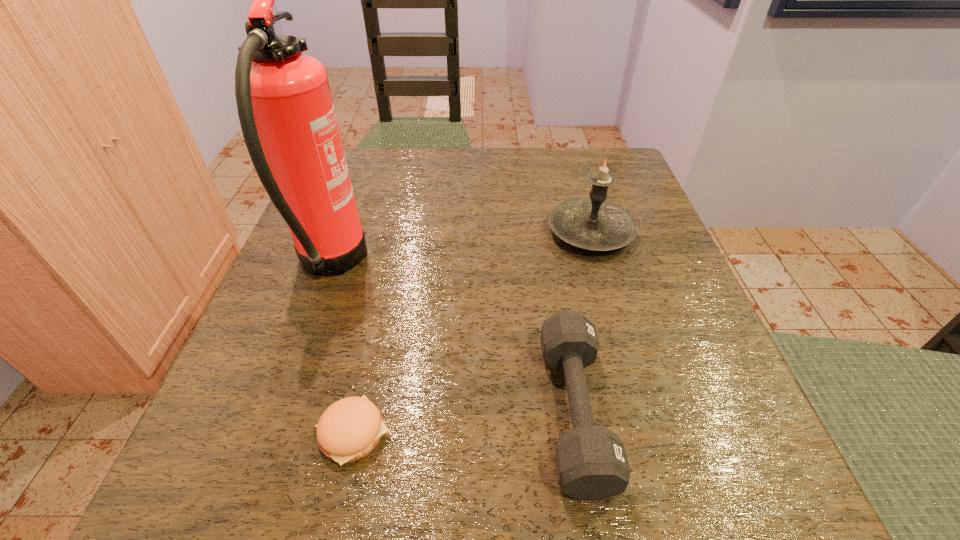
At what (x,y) coordinates should I click in order to perform the action: click on the tallest object. Please return your answer as a coordinate pair (x, y). Image resolution: width=960 pixels, height=540 pixels. Looking at the image, I should click on (285, 107).

Find the location of a particular element. This screenshot has width=960, height=540. candle is located at coordinates (593, 223).

You are a GUI agent. You are given a task and a screenshot of the screen. Output one action in this format:
    pyautogui.click(x=<x>, y=<y>)
    Task: Click on the dumbbell
    This screenshot has height=540, width=960.
    Given the screenshot: What is the action you would take?
    pyautogui.click(x=591, y=462)

Locate an element on the screen. patty is located at coordinates (349, 429).

What are the coordinates of `vacant space located at the nozzle of the tallest object` in the screenshot? It's located at (419, 265).

This screenshot has width=960, height=540. I want to click on vacant space located on the left of the candle, so click(x=522, y=232).

The image size is (960, 540). Find the location of `vacant space situated 0.210m on the left of the second shortest object`. vacant space situated 0.210m on the left of the second shortest object is located at coordinates (391, 411).

This screenshot has width=960, height=540. What are the coordinates of `free point located 0.130m on the right of the shortest object` in the screenshot? It's located at (492, 433).

I want to click on dumbbell that is at the near edge, so click(x=591, y=462).

The width and height of the screenshot is (960, 540). Find the location of `patty that is at the near edge`. patty that is at the near edge is located at coordinates (349, 429).